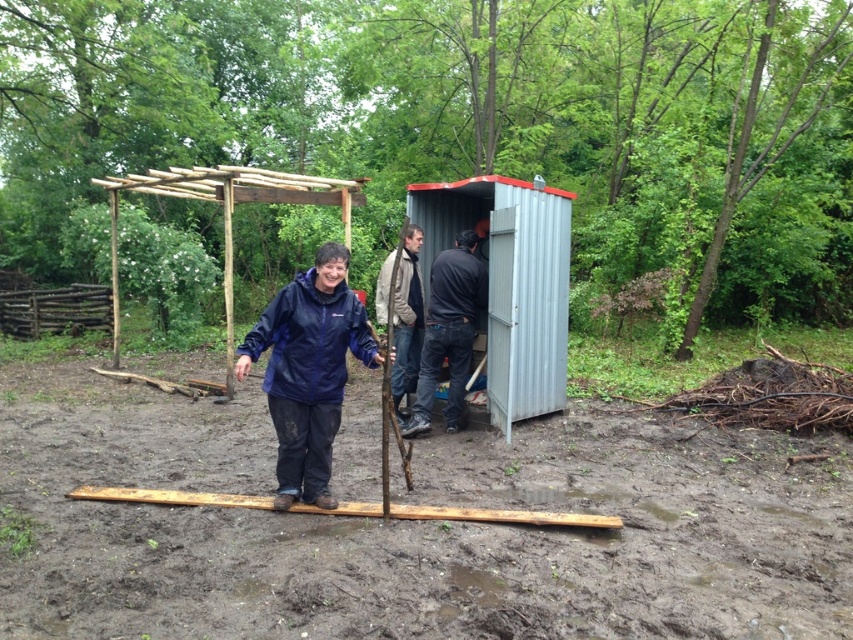
Question: Among these points, which one is nearest to the camera?

Choices:
 (A) (459, 324)
 (B) (350, 548)
 (C) (270, 337)
 (D) (251, 168)

Answer: (B)

Question: Is brown muddy dirt at center bigger than navy blue jacket at center?

Choices:
 (A) yes
 (B) no

Answer: (B)

Question: Which object is closer to the camera taking this photo?

Choices:
 (A) natural wood pergola at center
 (B) dark gray jeans at center
 (C) navy blue jacket at center

Answer: (C)

Question: Is navy blue jacket at center to the right of natural wood pergola at center from the viewer's perspective?

Choices:
 (A) no
 (B) yes

Answer: (B)

Question: Observing the image, what is the correct spatial positioning of dark gray jeans at center in reference to light brown leather jacket at center?

Choices:
 (A) right
 (B) left

Answer: (A)

Question: Which is nearer to the light brown leather jacket at center?

Choices:
 (A) navy blue jacket at center
 (B) metallic gray shed at center
 (C) brown muddy dirt at center
 (D) dark gray jeans at center

Answer: (D)